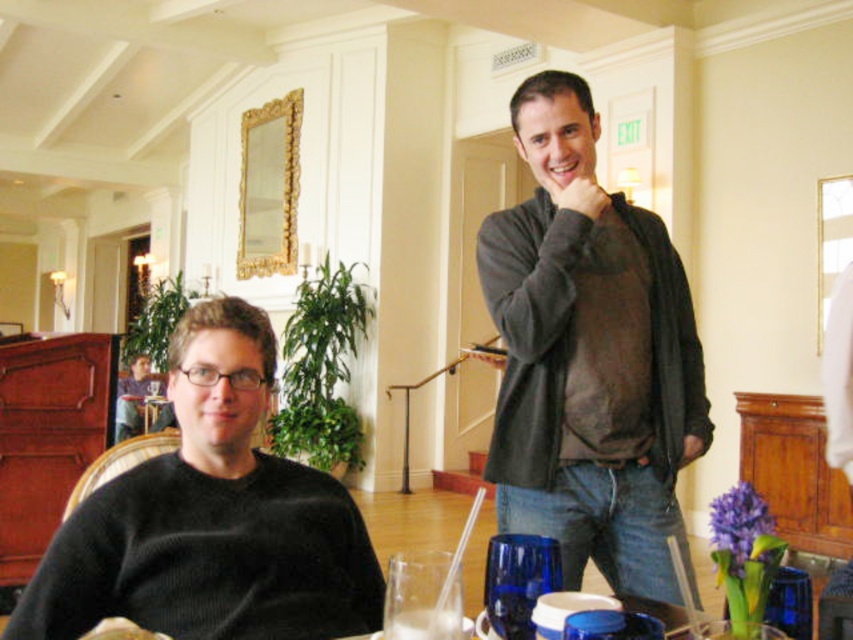
Question: Which of the following is the closest to the observer?

Choices:
 (A) (100, 634)
 (B) (231, 429)
 (C) (490, 262)

Answer: (A)

Question: Is dark gray sweater at upper right to the right of black matte sweater at left from the viewer's perspective?

Choices:
 (A) no
 (B) yes

Answer: (B)

Question: Does dark gray sweater at upper right have a larger size compared to white matte bread at lower left?

Choices:
 (A) no
 (B) yes

Answer: (B)

Question: Which point is farther to the camera?

Choices:
 (A) white matte bread at lower left
 (B) dark gray sweater at upper right
 (C) black matte sweater at left

Answer: (B)

Question: Which point is closer to the camera?

Choices:
 (A) [640, 324]
 (B) [109, 624]

Answer: (B)

Question: Can you confirm if black matte sweater at left is smaller than white matte bread at lower left?

Choices:
 (A) no
 (B) yes

Answer: (A)